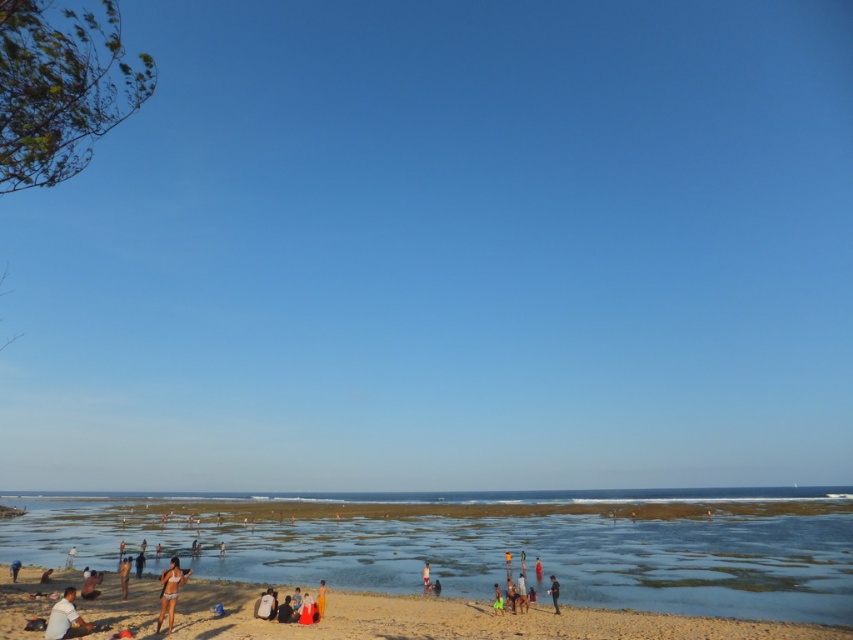
Question: Does clear water at lower left lie behind beige sand at lower center?

Choices:
 (A) no
 (B) yes

Answer: (A)

Question: Does white matte bikini at lower center have a smaller size compared to yellow sand at lower center?

Choices:
 (A) yes
 (B) no

Answer: (B)

Question: Which point is farther from the camera taking this photo?

Choices:
 (A) (122, 568)
 (B) (555, 605)

Answer: (A)

Question: Can you confirm if dark blue fabric at lower center is bigger than tan skin person at lower left?

Choices:
 (A) no
 (B) yes

Answer: (A)

Question: Among these points, which one is nearest to the camera?

Choices:
 (A) (322, 588)
 (B) (201, 602)
 (C) (10, 572)

Answer: (A)

Question: Estimate the real-world distances between objects in this image. Which object is closer to the yellow sand at lower center?

Choices:
 (A) light brown sand at lower center
 (B) dark blue fabric at lower center
 (C) beige sand at lower center

Answer: (C)